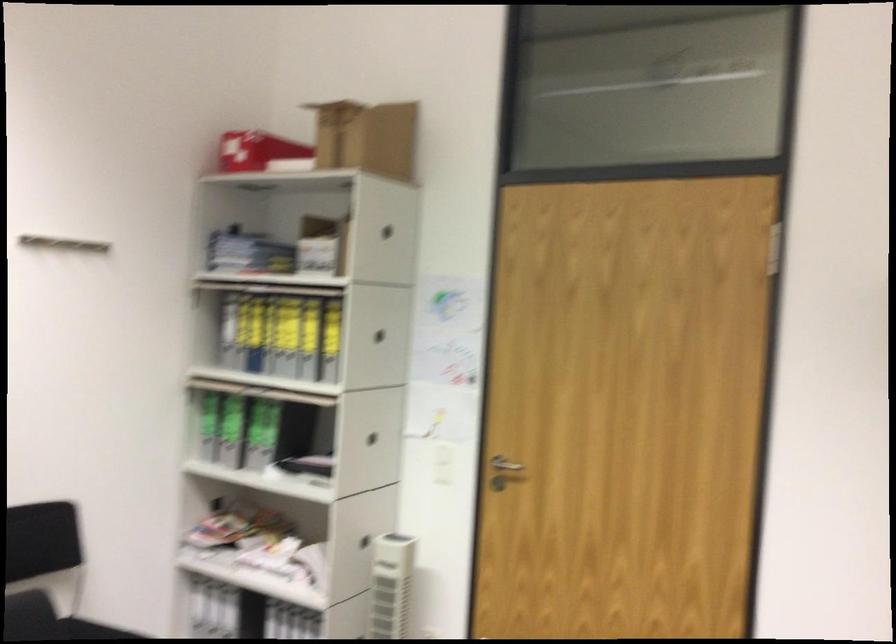
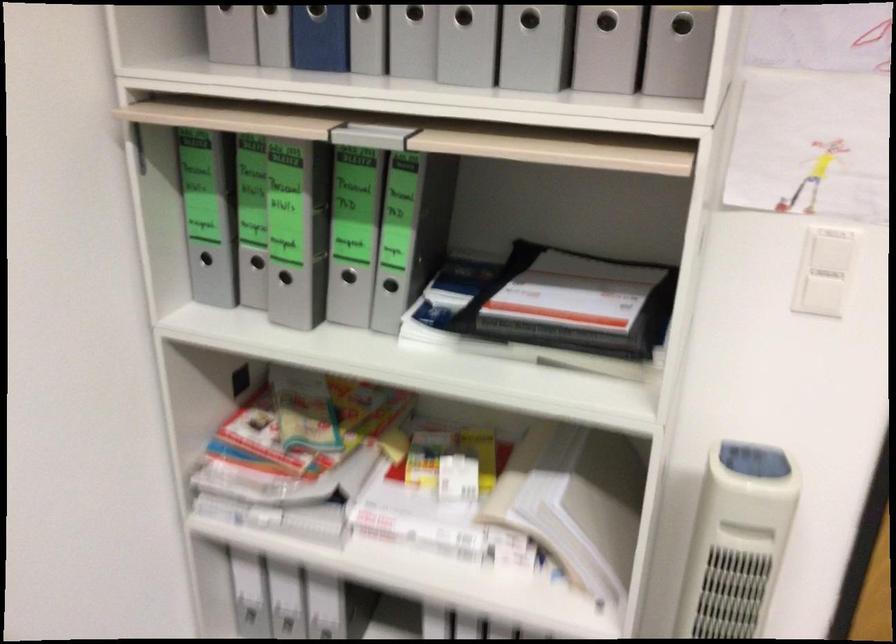
Where in the second image is the point corresponding to pixel 261 450 from the first image?

(348, 276)